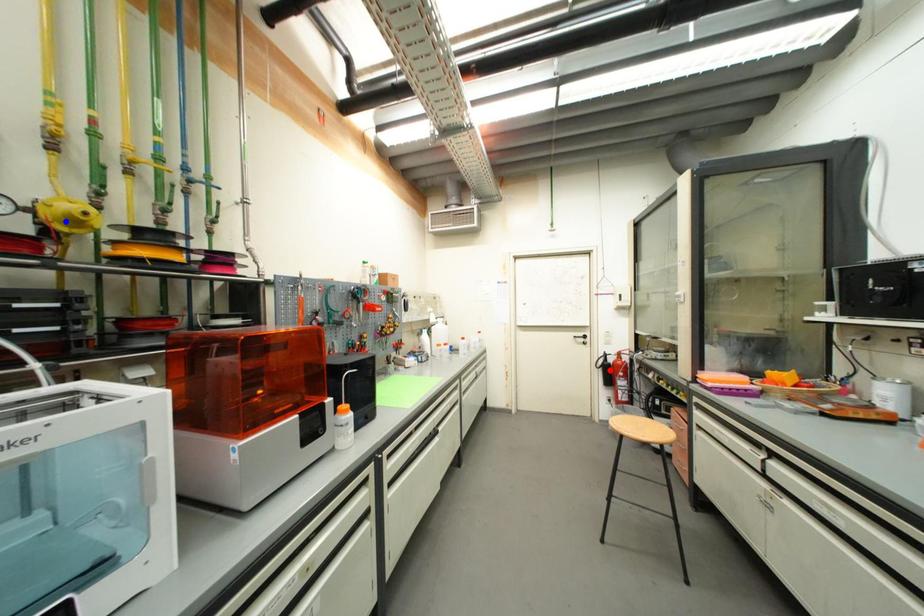
Question: Two points are marked on the image. Which point is closer to the camera?

Choices:
 (A) Blue point is closer.
 (B) Red point is closer.

Answer: (A)